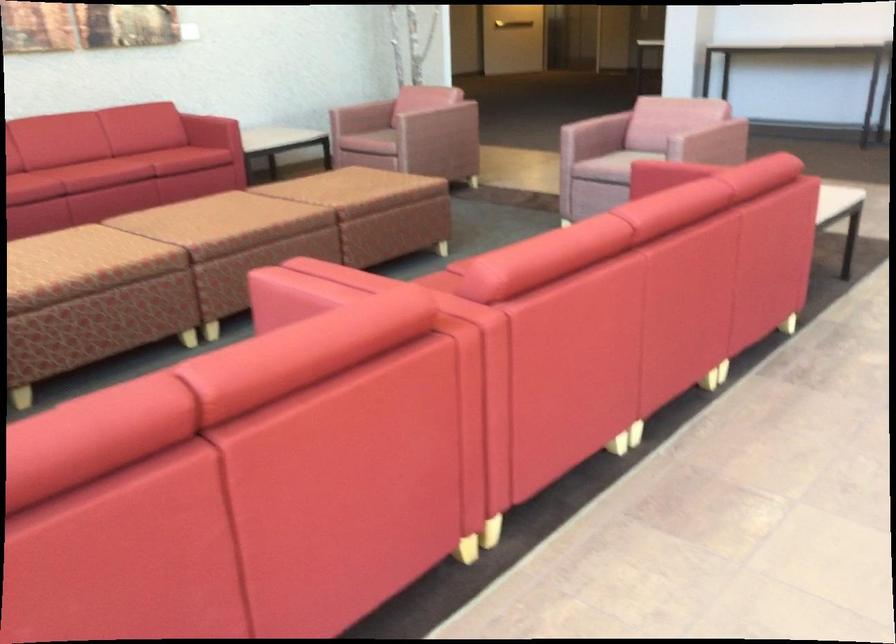
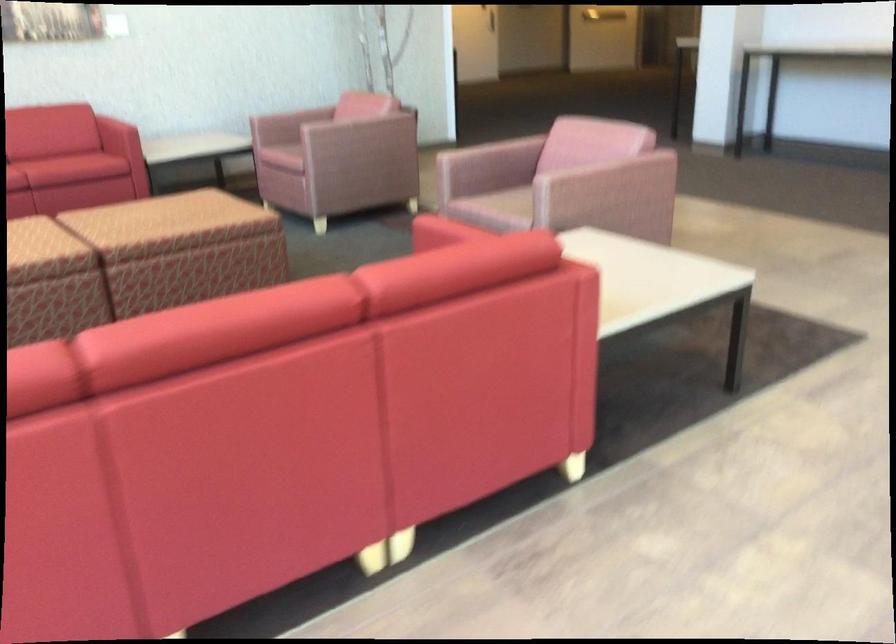
In a continuous first-person perspective shot, in which direction is the camera moving?

The cameraman moved toward right, forward.